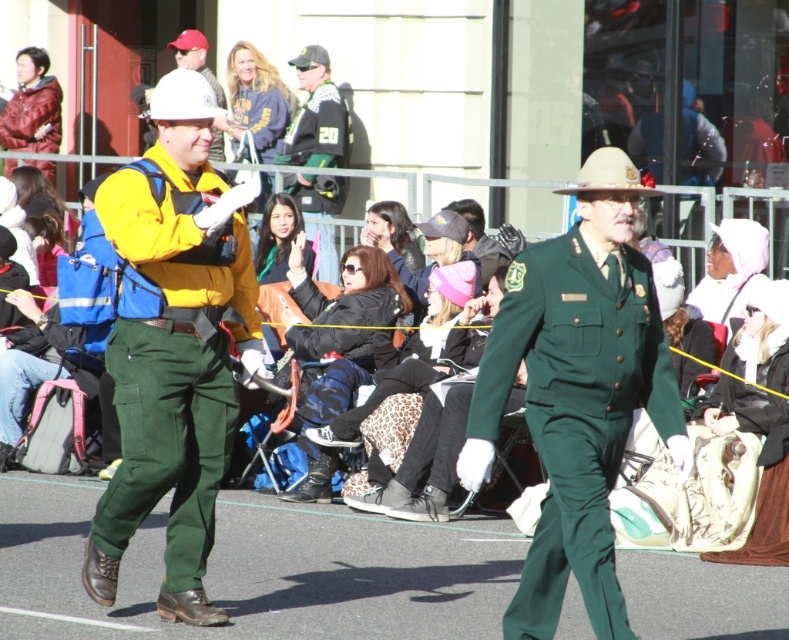
Is green uniform at center below green cotton pants at left?

Correct, green uniform at center is located below green cotton pants at left.

Locate an element on the screen. The width and height of the screenshot is (789, 640). green uniform at center is located at coordinates (574, 413).

You are a GUI agent. You are given a task and a screenshot of the screen. Output one action in this format:
    pyautogui.click(x=<x>, y=<y>)
    Task: Click on the green uniform at center
    This screenshot has height=640, width=789.
    Given the screenshot: What is the action you would take?
    pyautogui.click(x=574, y=413)

Does green uniform at center lie behind white matte hard hat at upper center?

No.

Is point (507, 352) behind point (215, 141)?

No, it is not.

Who is more distant from viewer, (522, 288) or (221, 148)?

Positioned behind is point (221, 148).

The image size is (789, 640). I want to click on green uniform at center, so click(x=574, y=413).

Who is lower down, green cotton pants at left or white matte hard hat at upper center?

green cotton pants at left

Is green cotton pants at left closer to camera compared to white matte hard hat at upper center?

Yes.

Does point (204, 429) come in front of point (148, 136)?

Yes, it is.

You are a GUI agent. You are given a task and a screenshot of the screen. Output one action in this format:
    pyautogui.click(x=<x>, y=<y>)
    Task: Click on the green cotton pants at left
    This screenshot has width=789, height=640.
    Given the screenshot: What is the action you would take?
    pyautogui.click(x=166, y=440)